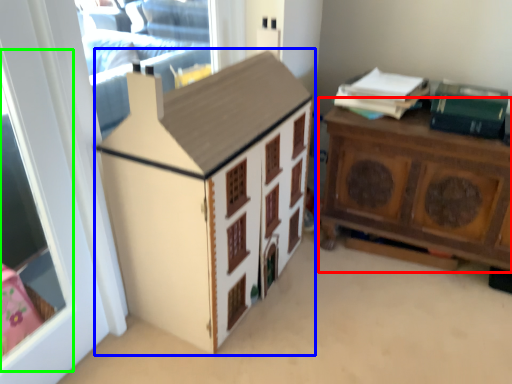
Question: Considering the real-world distances, which object is closest to nightstand (highlighted by a red box)? cabinetry (highlighted by a blue box) or window screen (highlighted by a green box).

Choices:
 (A) cabinetry
 (B) window screen

Answer: (A)